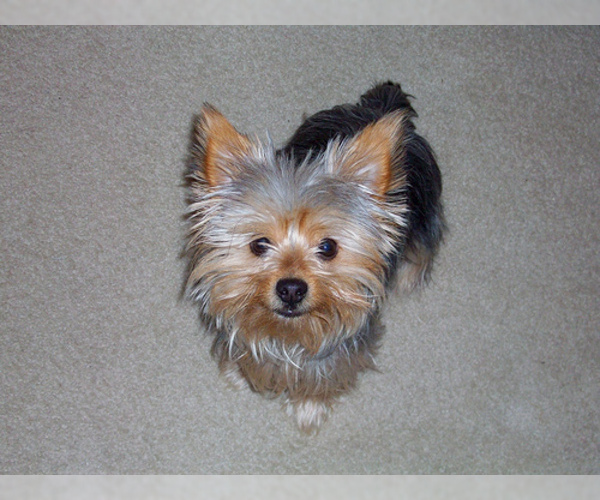
Locate an element on the screen. The height and width of the screenshot is (500, 600). beige carpet is located at coordinates (125, 369).